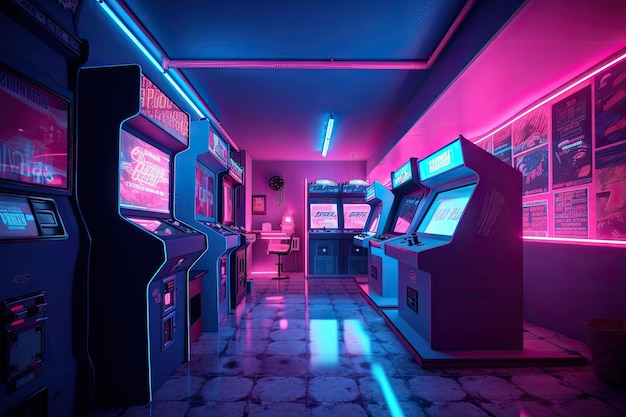
Where is `poster`? The width and height of the screenshot is (626, 417). poster is located at coordinates (613, 142), (577, 150), (540, 170), (538, 142), (504, 142), (577, 220), (600, 220), (533, 220).